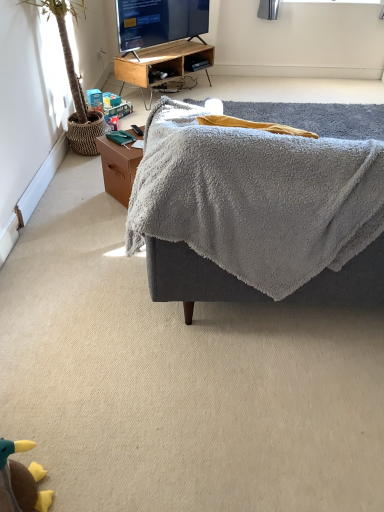
At what (x,y) coordinates should I click in order to perform the action: click on vacant space behind plush yellow duck at lower left. Please return your answer as a coordinate pair (x, y). The width and height of the screenshot is (384, 512). Looking at the image, I should click on (52, 434).